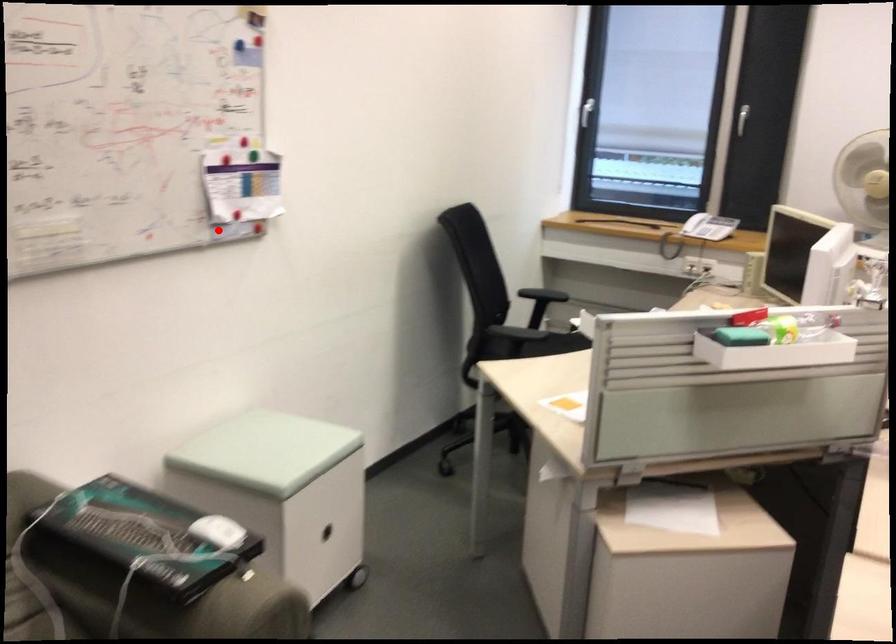
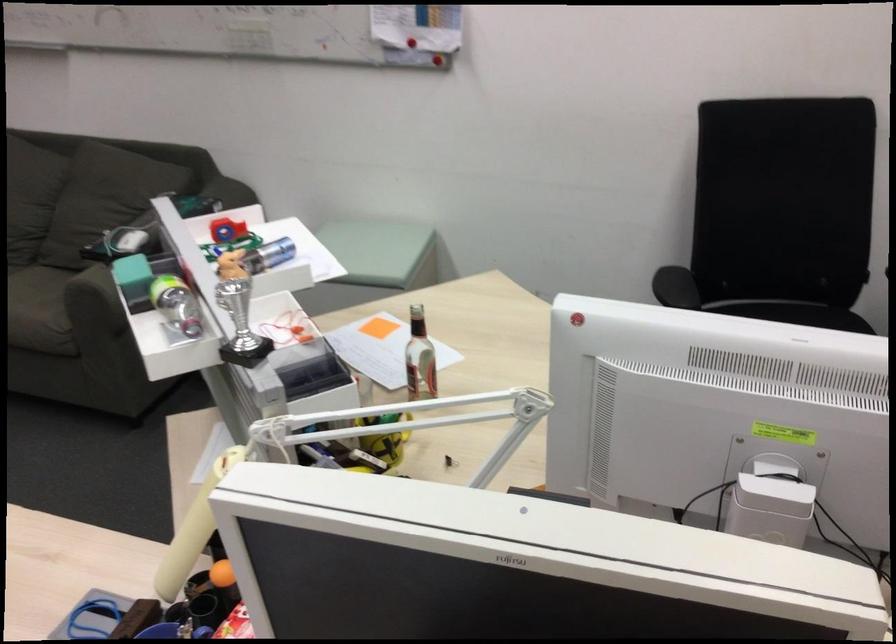
Locate, in the second image, the point that corresponds to the highlighted location in the first image.

(409, 59)